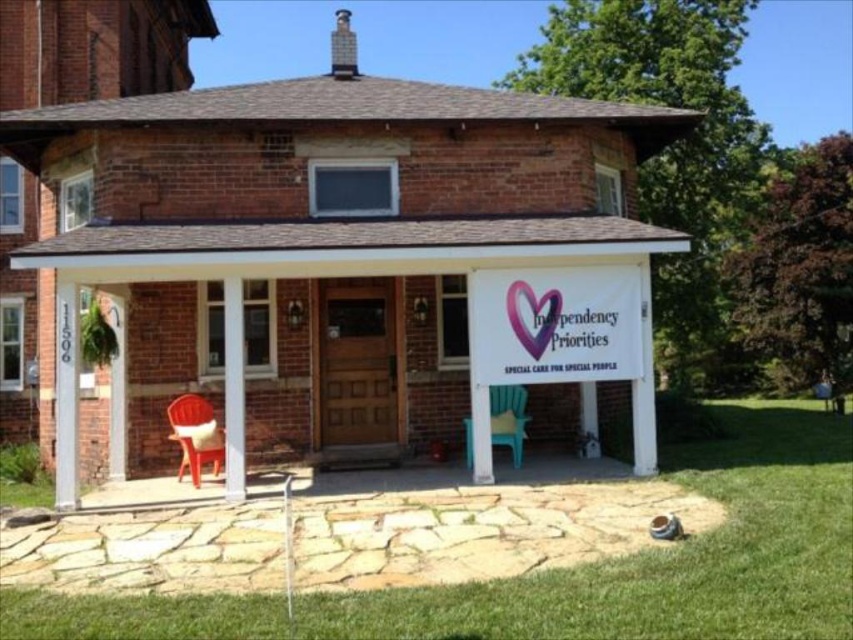
Does green grass at lower center have a lesser width compared to white painted wood at left?

No, green grass at lower center is not thinner than white painted wood at left.

Is point (843, 424) farther from viewer compared to point (242, 477)?

Yes, point (843, 424) is behind point (242, 477).

Measure the distance between point (107, 618) and camera.

Point (107, 618) and camera are 6.12 meters apart from each other.

Where is `green grass at lower center`? green grass at lower center is located at coordinates (581, 566).

Does pink fabric banner at center have a smaller size compared to white painted wood post at left?

Actually, pink fabric banner at center might be larger than white painted wood post at left.

Between pink fabric banner at center and white painted wood post at left, which one appears on the left side from the viewer's perspective?

white painted wood post at left

Locate an element on the screen. The image size is (853, 640). pink fabric banner at center is located at coordinates (555, 324).

Looking at this image, does pink fabric banner at center appear on the right side of teal plastic chair at center?

Indeed, pink fabric banner at center is positioned on the right side of teal plastic chair at center.

Who is positioned more to the right, pink fabric banner at center or teal plastic chair at center?

From the viewer's perspective, pink fabric banner at center appears more on the right side.

Is point (630, 356) behind point (509, 412)?

No, (630, 356) is in front of (509, 412).

Where is `pink fabric banner at center`? The width and height of the screenshot is (853, 640). pink fabric banner at center is located at coordinates (555, 324).